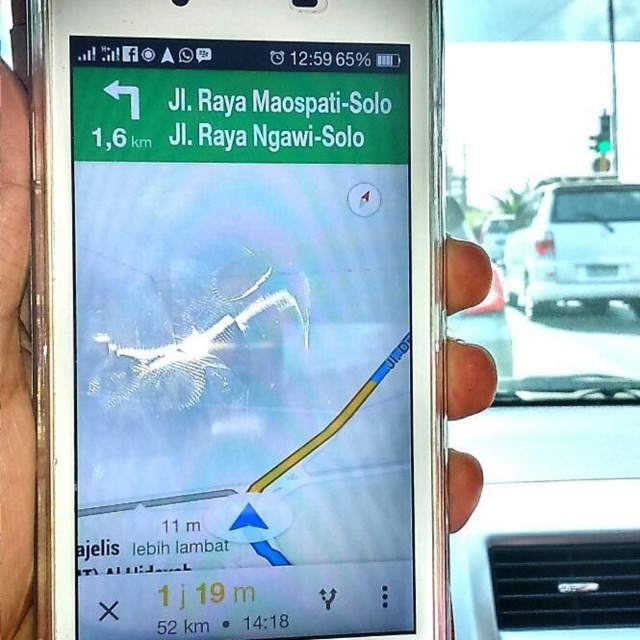
You are holding a smartphone with your right hand and want to check the navigation app. Which object in the image is thinner, the brown leather hand at upper left or the metallic at right?

The brown leather hand at upper left is thinner than the metallic at right.

You are a driver navigating through a route on your phone. You see two points on the map displayed on your screen. The first point is at coordinate point (x=182, y=278) and the second point is at coordinate point (x=528, y=282). Which point is closer to your current position according to the map?

Point (x=182, y=278) is in front of point (x=528, y=282), so the first point is closer to your current position.